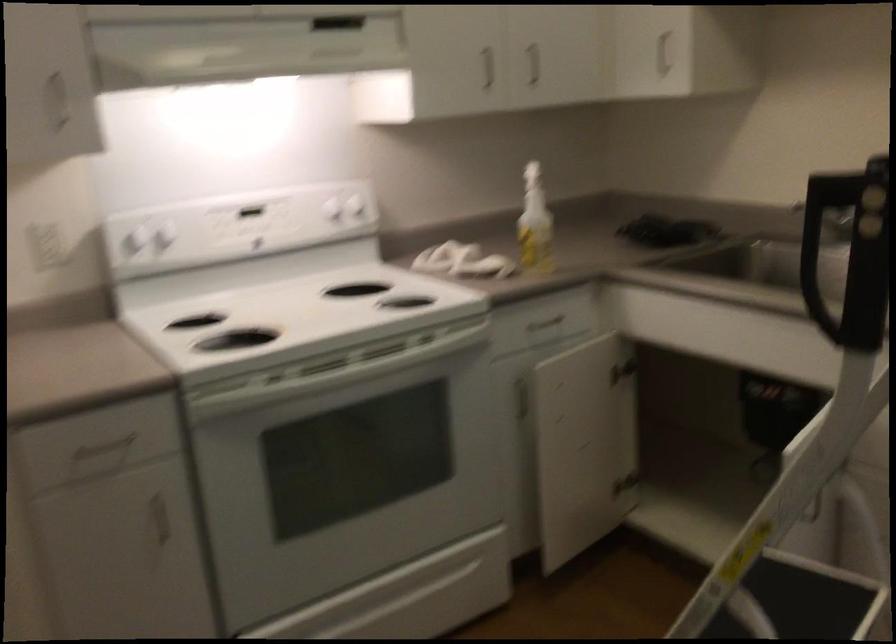
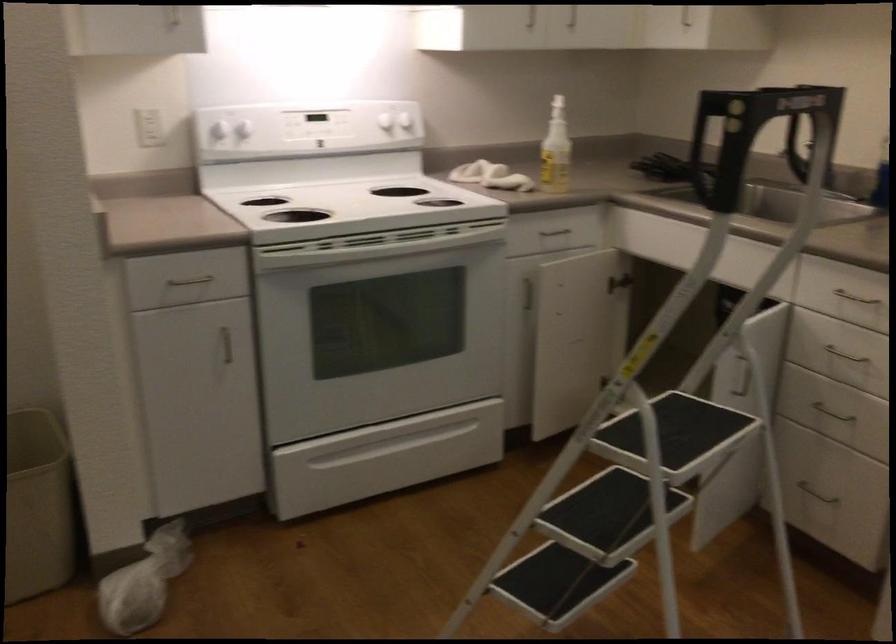
Question: The images are taken continuously from a first-person perspective. In which direction are you moving?

Choices:
 (A) Left
 (B) Right
 (C) Forward
 (D) Backward

Answer: (D)